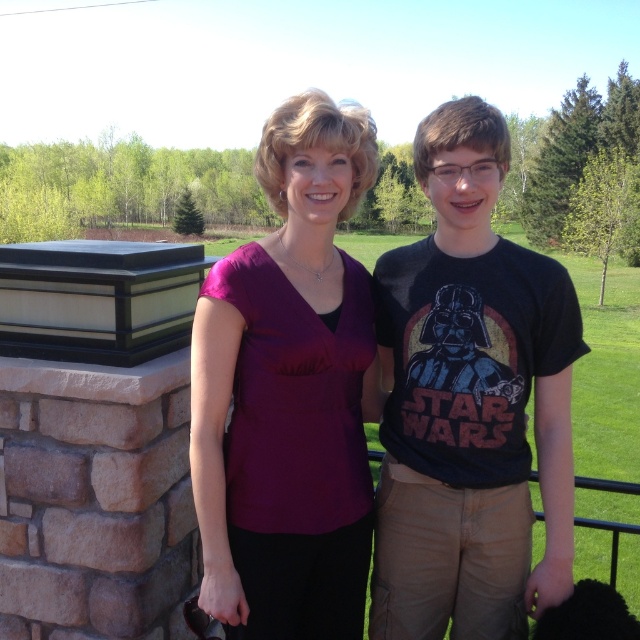
You are standing on the balcony and want to place a small potted plant between the two points marked as point [552,368] and point [323,138]. Which point should the plant be closer to in order to be closer to the viewer?

The plant should be closer to point [552,368] because it is further to the viewer than point [323,138].